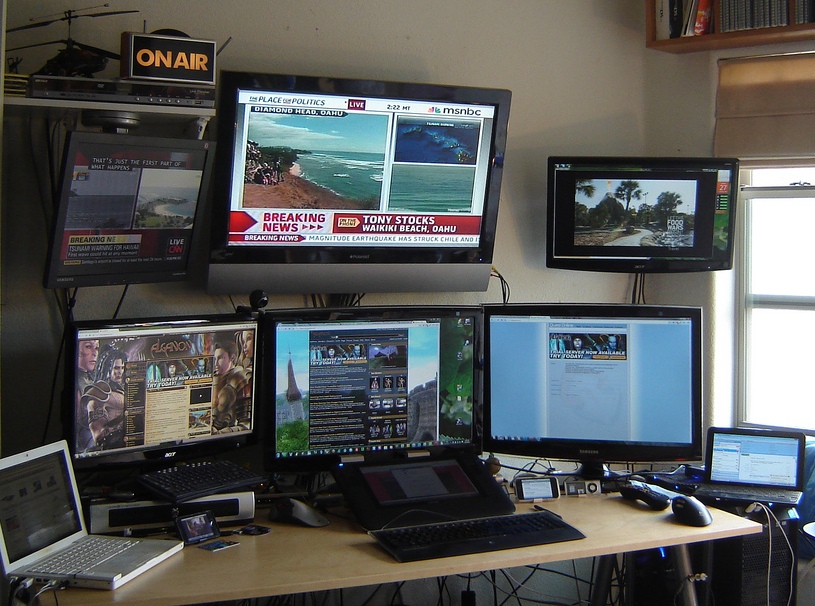
In order to click on desk in this screenshot , I will do `click(337, 553)`.